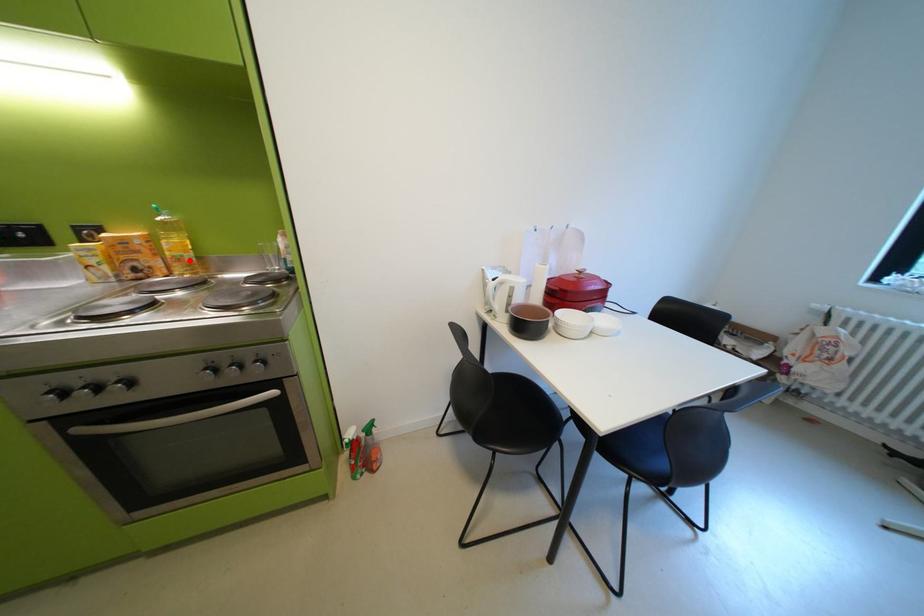
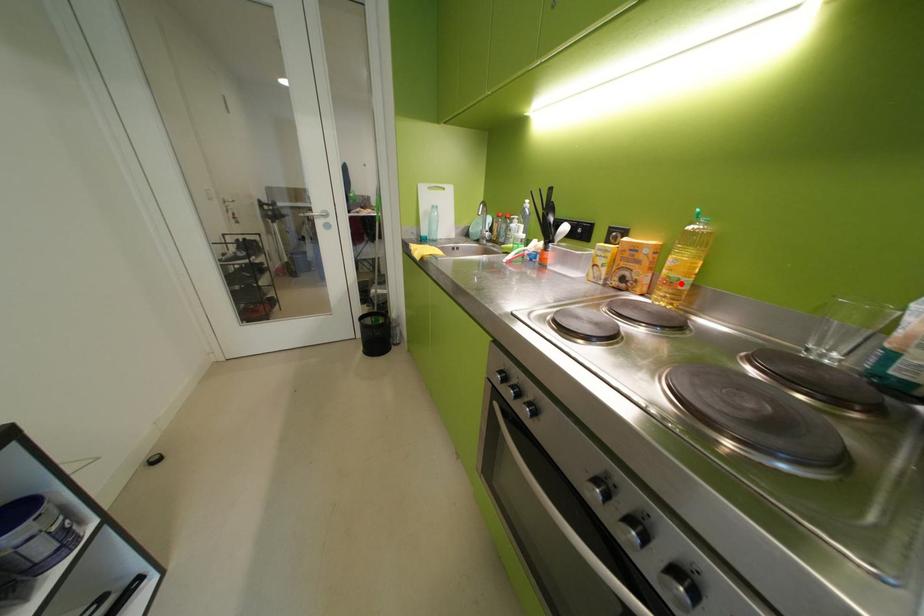
I am providing you with two images of the same scene from different viewpoints. A red point is marked on the first image and another point is marked on the second image. Is the marked point in image1 the same physical position as the marked point in image2?

Yes